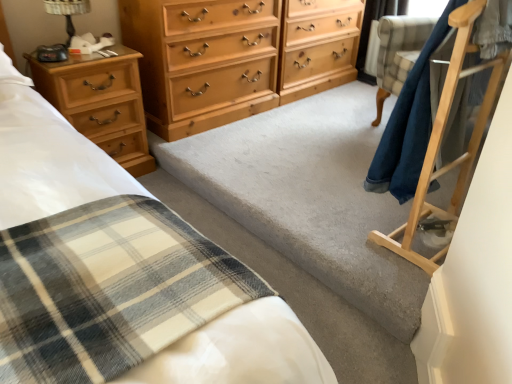
Question: From a real-world perspective, is light brown wood dresser at center located beneath metallic black table lamp at upper left?

Choices:
 (A) yes
 (B) no

Answer: (A)

Question: From the image's perspective, is light brown wood dresser at center under metallic black table lamp at upper left?

Choices:
 (A) no
 (B) yes

Answer: (A)

Question: Is metallic black table lamp at upper left completely or partially inside light brown wood dresser at center?

Choices:
 (A) no
 (B) yes

Answer: (A)

Question: Considering the relative sizes of light brown wood dresser at center and metallic black table lamp at upper left in the image provided, is light brown wood dresser at center wider than metallic black table lamp at upper left?

Choices:
 (A) yes
 (B) no

Answer: (A)

Question: From the image's perspective, does light brown wood dresser at center appear higher than metallic black table lamp at upper left?

Choices:
 (A) yes
 (B) no

Answer: (A)

Question: In terms of size, does light brown wood chest of drawers at left, positioned as the second chest of drawers in right-to-left order, appear bigger or smaller than metallic black table lamp at upper left?

Choices:
 (A) big
 (B) small

Answer: (A)

Question: In the image, is light brown wood chest of drawers at left, which is the 1th chest of drawers from left to right, on the left side or the right side of metallic black table lamp at upper left?

Choices:
 (A) right
 (B) left

Answer: (A)

Question: From the image's perspective, is light brown wood chest of drawers at left, positioned as the second chest of drawers in right-to-left order, positioned above or below metallic black table lamp at upper left?

Choices:
 (A) above
 (B) below

Answer: (B)

Question: Is light brown wood chest of drawers at left, positioned as the second chest of drawers in right-to-left order, spatially inside metallic black table lamp at upper left, or outside of it?

Choices:
 (A) outside
 (B) inside

Answer: (A)

Question: From a real-world perspective, is light brown wood chest of drawers at center, the second chest of drawers viewed from the left, above or below light brown wood dresser at center?

Choices:
 (A) below
 (B) above

Answer: (B)

Question: Considering the positions of light brown wood chest of drawers at center, marked as the 1th chest of drawers in a right-to-left arrangement, and light brown wood dresser at center in the image, is light brown wood chest of drawers at center, marked as the 1th chest of drawers in a right-to-left arrangement, wider or thinner than light brown wood dresser at center?

Choices:
 (A) wide
 (B) thin

Answer: (A)

Question: In the image, is light brown wood chest of drawers at center, the second chest of drawers viewed from the left, on the left side or the right side of light brown wood dresser at center?

Choices:
 (A) left
 (B) right

Answer: (A)

Question: Relative to light brown wood dresser at center, is light brown wood chest of drawers at center, the second chest of drawers viewed from the left, in front or behind?

Choices:
 (A) front
 (B) behind

Answer: (A)

Question: Considering the relative positions of metallic black table lamp at upper left and light brown wood dresser at center in the image provided, is metallic black table lamp at upper left to the left or to the right of light brown wood dresser at center?

Choices:
 (A) left
 (B) right

Answer: (A)

Question: From the image's perspective, relative to light brown wood dresser at center, is metallic black table lamp at upper left above or below?

Choices:
 (A) below
 (B) above

Answer: (A)